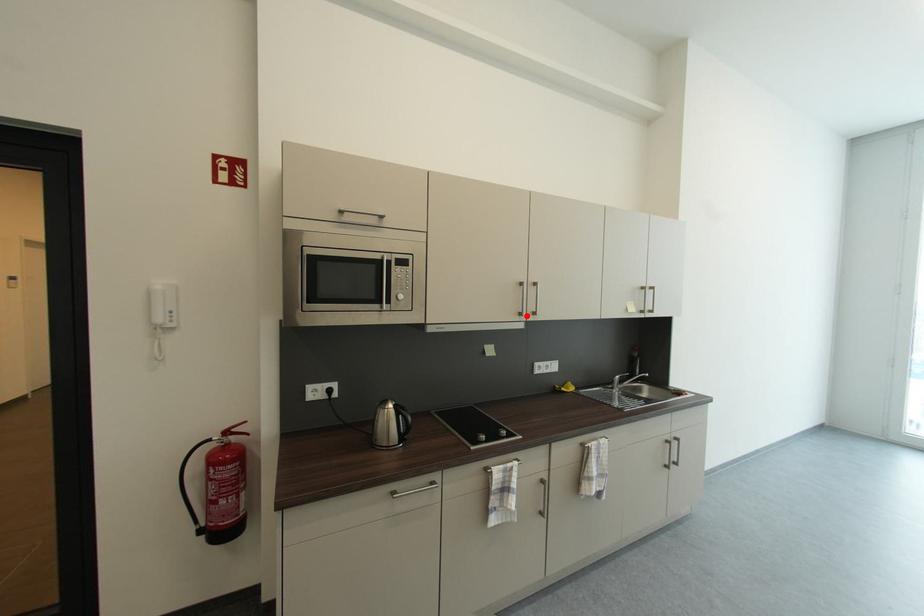
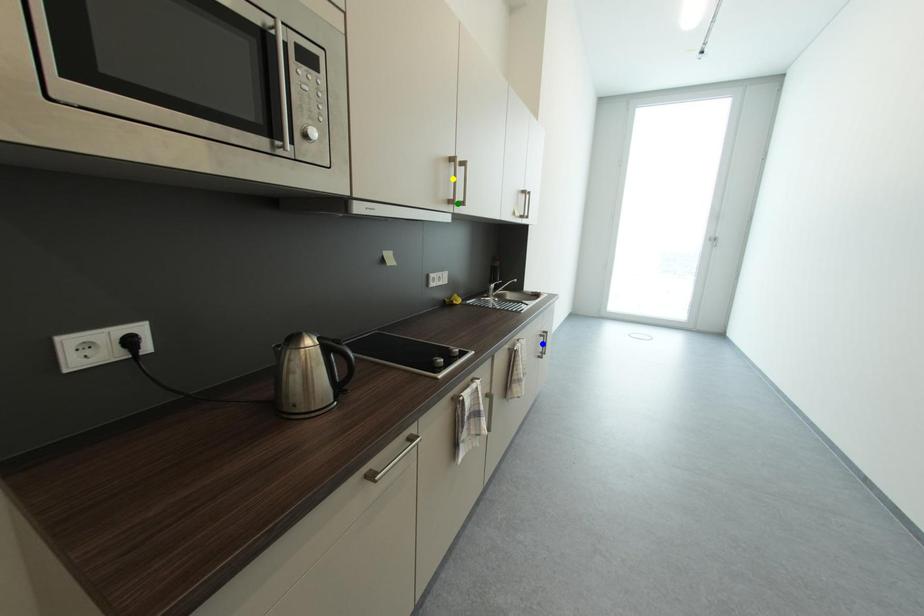
Question: I am providing you with two images of the same scene from different viewpoints. A red point is marked on the first image. You are given multiple points on the second image. Which spot in image 2 lines up with the point in image 1?

Choices:
 (A) green point
 (B) yellow point
 (C) blue point

Answer: (A)